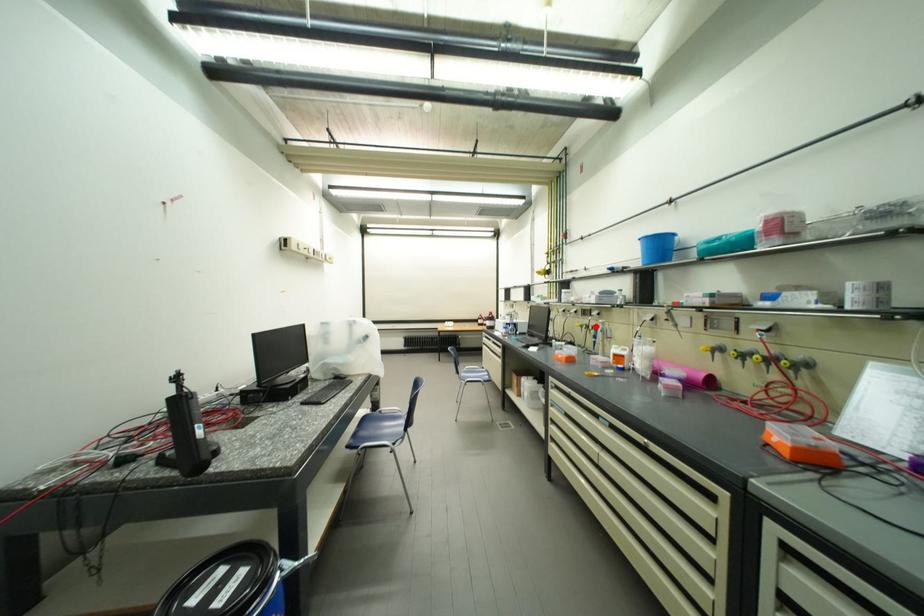
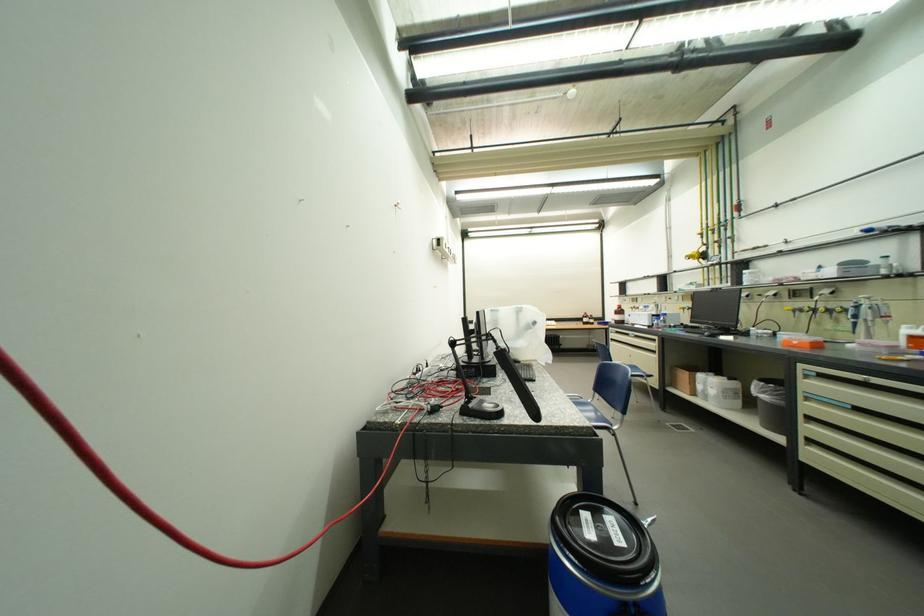
The point at the highlighted location is marked in the first image. Where is the corresponding point in the second image?

(819, 309)